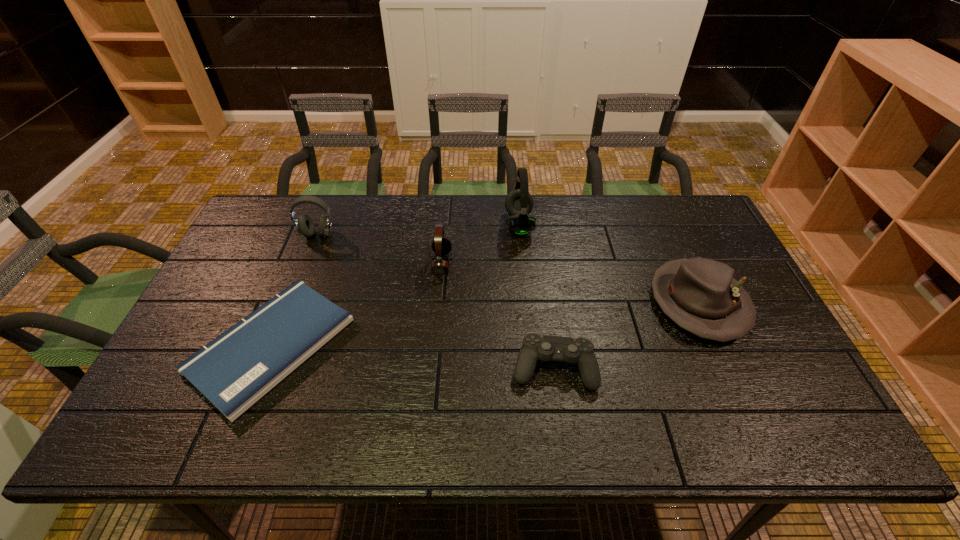
Identify the location of vacant point that satisfies the following two spatial constraints: 1. on the ear cups of the rightmost headset; 2. on the ear cups of the leftmost headset. The height and width of the screenshot is (540, 960). click(520, 235).